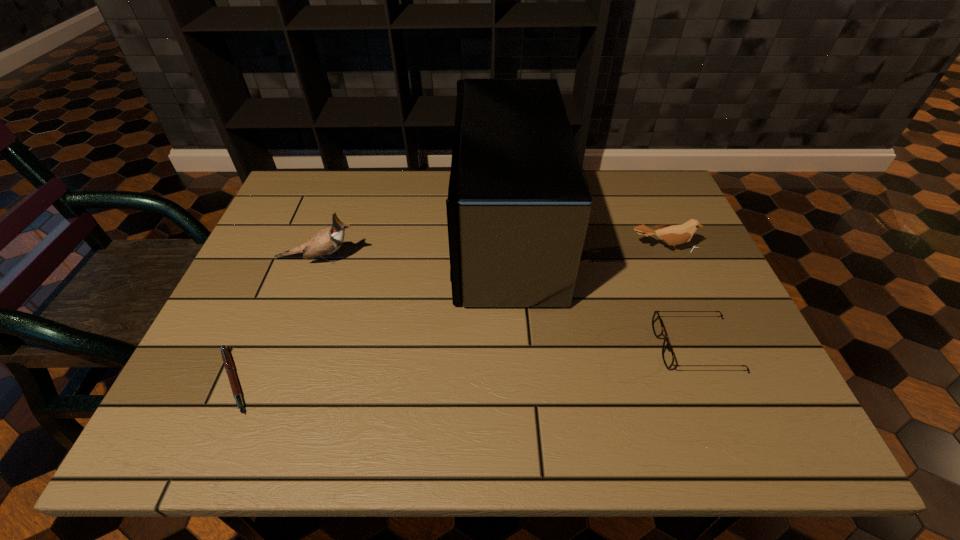
Where is `the third object from left to right`? The width and height of the screenshot is (960, 540). the third object from left to right is located at coordinates (518, 207).

Find the location of a particular element. the tallest object is located at coordinates (518, 207).

Where is `the left bird`? This screenshot has height=540, width=960. the left bird is located at coordinates (326, 241).

In order to click on the taller bird in this screenshot , I will do `click(326, 241)`.

Locate an element on the screen. Image resolution: width=960 pixels, height=540 pixels. the right bird is located at coordinates (674, 235).

Where is `the third tallest object`? the third tallest object is located at coordinates (674, 235).

Locate an element on the screen. The image size is (960, 540). the fourth tallest object is located at coordinates (667, 354).

In order to click on the shortest object in this screenshot , I will do `click(228, 364)`.

Find the location of a particular element. The image size is (960, 540). vacant space situated 0.360m on the front-facing side of the tallest object is located at coordinates (321, 231).

The height and width of the screenshot is (540, 960). Identify the location of vacant area situated on the front-facing side of the tallest object. (328, 231).